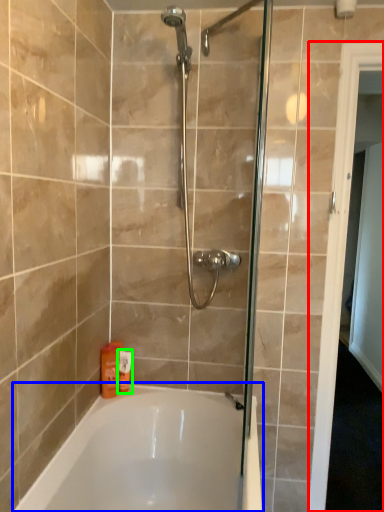
Question: Based on their relative distances, which object is nearer to screen door (highlighted by a red box)? Choose from bathtub (highlighted by a blue box) and toiletry (highlighted by a green box).

Choices:
 (A) bathtub
 (B) toiletry

Answer: (A)